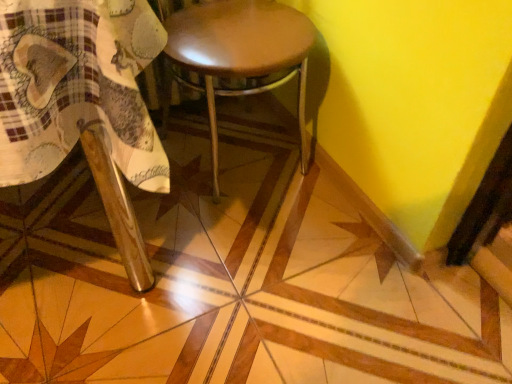
Identify the location of empty space that is to the right of wooden chair at lower left. The height and width of the screenshot is (384, 512). (295, 278).